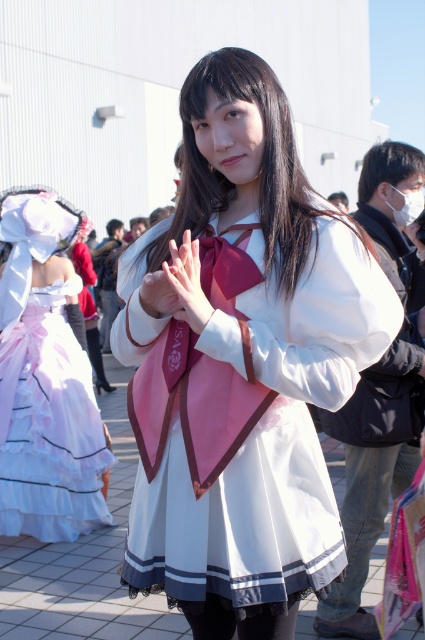
Question: Can you confirm if white satin dress at center is positioned below pink satin hand at center?

Choices:
 (A) no
 (B) yes

Answer: (B)

Question: Can you confirm if white satin dress at center is thinner than white lace dress at left?

Choices:
 (A) no
 (B) yes

Answer: (A)

Question: Can you confirm if white satin dress at center is positioned above white lace dress at left?

Choices:
 (A) no
 (B) yes

Answer: (B)

Question: Which of the following is the closest to the observer?

Choices:
 (A) white satin dress at center
 (B) pink satin hand at center

Answer: (B)

Question: Which point is closer to the camera?

Choices:
 (A) white satin dress at center
 (B) pink satin hand at center

Answer: (B)

Question: Among these points, which one is farthest from the camera?

Choices:
 (A) (306, 372)
 (B) (47, 524)
 (C) (197, 241)

Answer: (B)